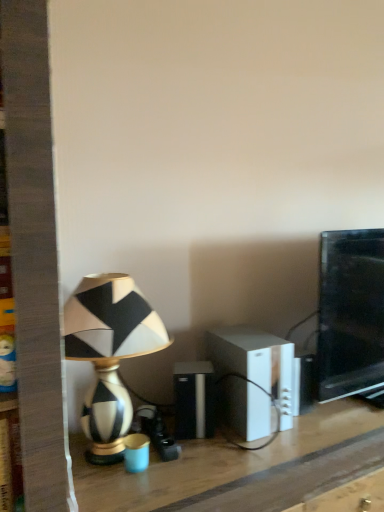
Find the location of a particular element. The image size is (384, 512). vacant space that's between black and white ceramic lamp at left and black plastic speaker at center, which is the first speaker from left to right is located at coordinates tap(199, 451).